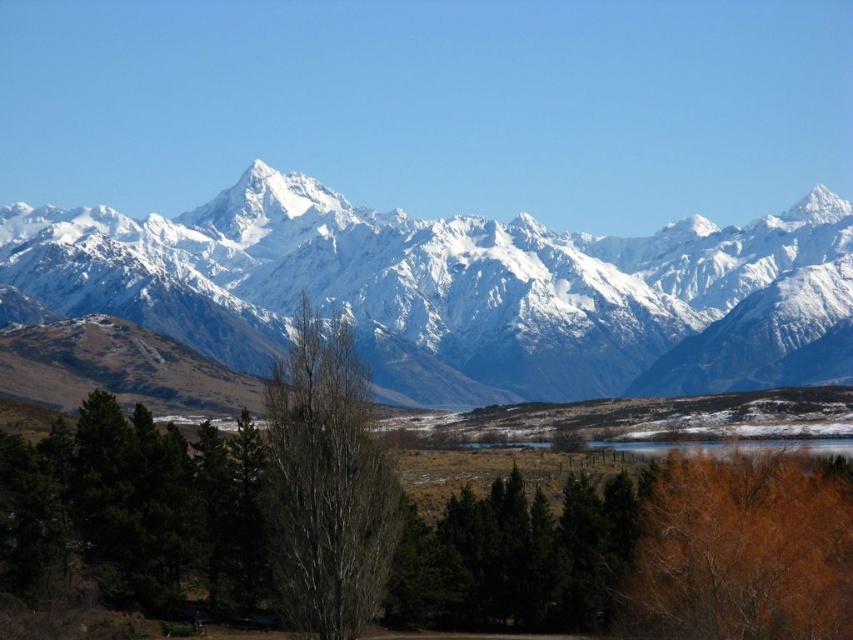
Question: Which object is positioned farthest from the white snow-covered mountain range at upper center?

Choices:
 (A) brown leafy tree at lower right
 (B) white snow-covered mountain at upper center
 (C) bare bark tree at center

Answer: (A)

Question: Can you confirm if white snow-covered mountain range at upper center is positioned below bare bark tree at center?

Choices:
 (A) no
 (B) yes

Answer: (A)

Question: Can you confirm if brown leafy tree at lower right is positioned to the left of bare bark tree at center?

Choices:
 (A) yes
 (B) no

Answer: (B)

Question: Estimate the real-world distances between objects in this image. Which object is closer to the bare bark tree at center?

Choices:
 (A) white snow-covered mountain range at upper center
 (B) white snow-covered mountain at upper center
 (C) brown leafy tree at lower right

Answer: (A)

Question: Which of the following is the farthest from the observer?

Choices:
 (A) (171, 257)
 (B) (277, 458)
 (C) (225, 176)

Answer: (A)

Question: In this image, where is white snow-covered mountain at upper center located relative to white snow-covered mountain range at upper center?

Choices:
 (A) above
 (B) below

Answer: (A)